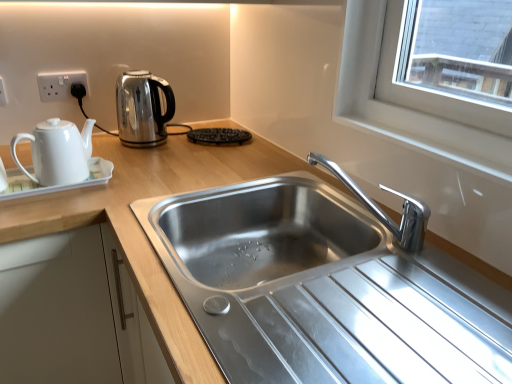
Question: From a real-world perspective, is white plastic socket at upper left, placed as the first electric outlet when sorted from back to front, physically located above or below white glossy teapot at left, arranged as the second kettle when viewed from the back?

Choices:
 (A) above
 (B) below

Answer: (A)

Question: In terms of width, does white plastic socket at upper left, which appears as the first electric outlet when viewed from the right, look wider or thinner when compared to white glossy teapot at left, the 1th kettle from the front?

Choices:
 (A) thin
 (B) wide

Answer: (A)

Question: Which object is positioned closest to the white plastic socket at upper left, which ranks as the second electric outlet in left-to-right order?

Choices:
 (A) chrome metallic faucet at center
 (B) stainless steel sink at center
 (C) satin silver kettle at upper left, the 2th kettle in the front-to-back sequence
 (D) black textured waffle iron at center
 (E) white glossy teapot at left, arranged as the second kettle when viewed from the back

Answer: (C)

Question: Estimate the real-world distances between objects in this image. Which object is farther from the satin silver kettle at upper left, which appears as the first kettle when viewed from the back?

Choices:
 (A) black textured waffle iron at center
 (B) white plastic electric outlet at upper left, the second electric outlet viewed from the right
 (C) white glossy teapot at left, the 1th kettle from the front
 (D) white plastic socket at upper left, placed as the first electric outlet when sorted from back to front
 (E) stainless steel sink at center

Answer: (B)